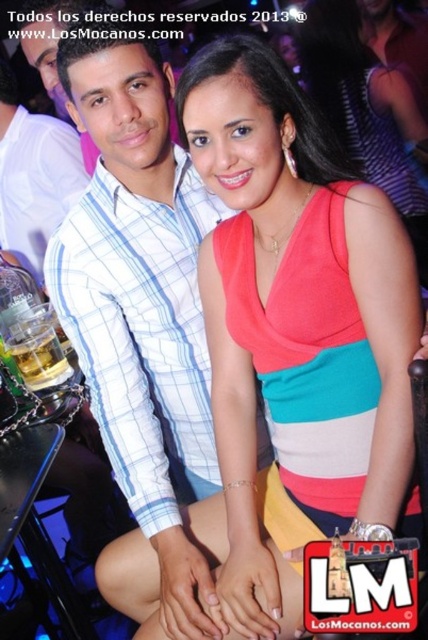
Can you confirm if matte pink dress at center is smaller than white checkered shirt at center?

Yes, matte pink dress at center is smaller than white checkered shirt at center.

Can you confirm if matte pink dress at center is positioned below white checkered shirt at center?

Yes, matte pink dress at center is below white checkered shirt at center.

Between point (282, 392) and point (88, 220), which one is positioned in front?

Positioned in front is point (282, 392).

The height and width of the screenshot is (640, 428). Find the location of `matte pink dress at center`. matte pink dress at center is located at coordinates (294, 323).

In the scene shown: Who is shorter, white checkered shirt at center or matte plaid shirt at left?

matte plaid shirt at left

Can you confirm if white checkered shirt at center is positioned above matte plaid shirt at left?

Actually, white checkered shirt at center is below matte plaid shirt at left.

Locate an element on the screen. white checkered shirt at center is located at coordinates (140, 301).

At what (x,y) coordinates should I click in order to perform the action: click on white checkered shirt at center. Please return your answer as a coordinate pair (x, y). Looking at the image, I should click on [x=140, y=301].

Which of these two, matte pink dress at center or matte plaid shirt at left, stands taller?

With more height is matte pink dress at center.

Describe the element at coordinates (294, 323) in the screenshot. The image size is (428, 640). I see `matte pink dress at center` at that location.

The width and height of the screenshot is (428, 640). What are the coordinates of `matte pink dress at center` in the screenshot? It's located at (294, 323).